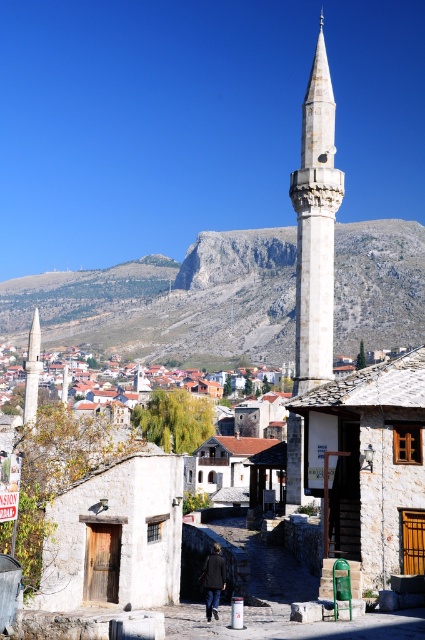
You are a drone operator tasked with capturing aerial footage of the rocky gray mountain at upper center. The drone must fly from the minaret on the right to the mountain. Given the coordinates provided in the description, in which general direction should the drone head from the minaret to reach the mountain?

The rocky gray mountain at upper center is located at point (170, 301), so the drone should head towards the upper center direction from the minaret on the right to reach the mountain.